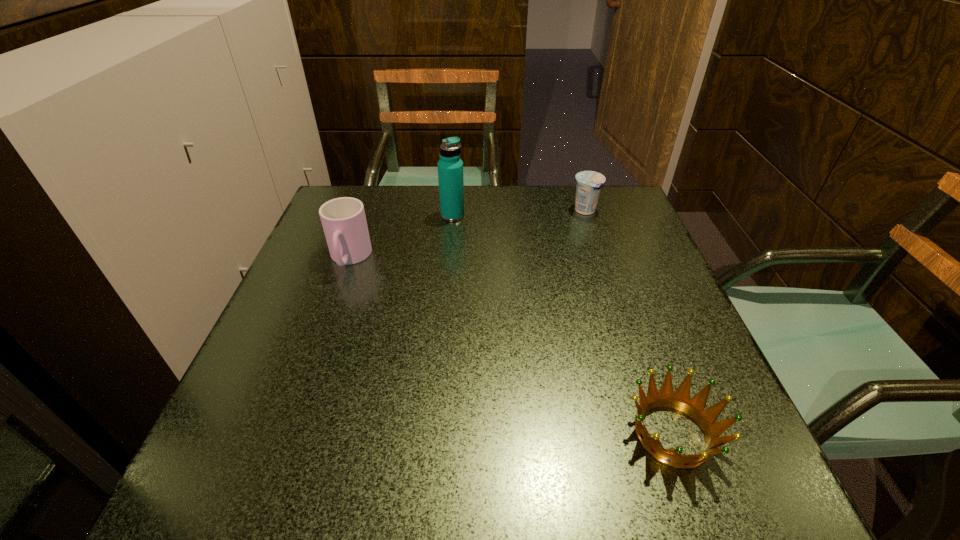
This screenshot has height=540, width=960. I want to click on the third object from right to left, so click(x=450, y=167).

Locate an element on the screen. water bottle is located at coordinates (450, 167).

You are a GUI agent. You are given a task and a screenshot of the screen. Output one action in this format:
    pyautogui.click(x=<x>, y=<y>)
    Task: Click on the second tallest object
    This screenshot has height=540, width=960.
    Given the screenshot: What is the action you would take?
    pyautogui.click(x=343, y=219)

Locate an element on the screen. The image size is (960, 540). the leftmost object is located at coordinates (x=343, y=219).

What are the coordinates of `the third tallest object` in the screenshot? It's located at (589, 183).

The image size is (960, 540). What are the coordinates of `the nearest object` in the screenshot? It's located at (680, 400).

Locate an element on the screen. The image size is (960, 540). crown is located at coordinates coord(680,400).

Where is `vacant region located 0.170m on the left of the tallest object`? vacant region located 0.170m on the left of the tallest object is located at coordinates (376, 215).

I want to click on free point located with the handle on the side of the leftmost object, so click(x=300, y=395).

This screenshot has height=540, width=960. Find the location of `vacant area situated on the front of the yogurt`. vacant area situated on the front of the yogurt is located at coordinates (622, 322).